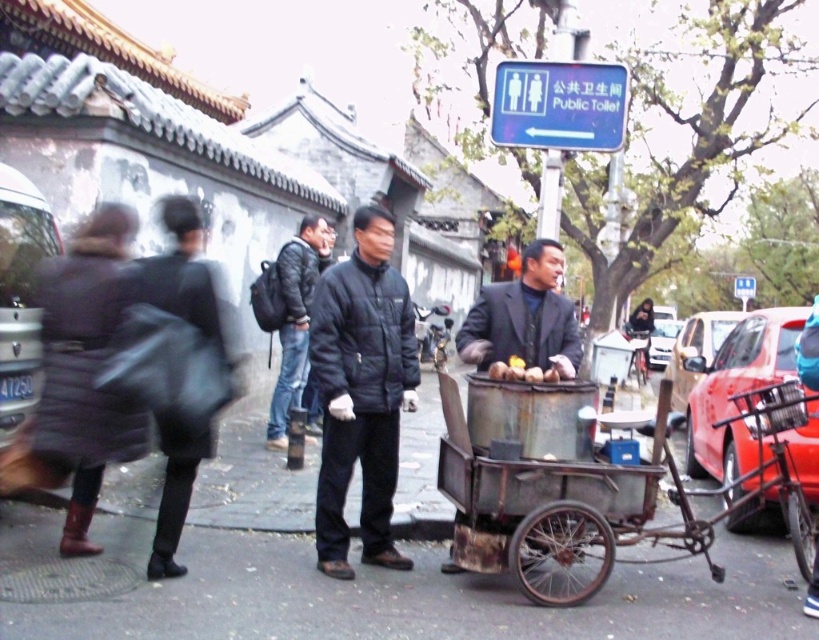
Can you confirm if dark gray jacket at center is thinner than dark gray puffy jacket at center?

No, dark gray jacket at center is not thinner than dark gray puffy jacket at center.

Find the location of a particular element. dark gray jacket at center is located at coordinates (523, 317).

The height and width of the screenshot is (640, 819). Identify the location of dark gray jacket at center. (523, 317).

Does black matte jacket at center appear on the right side of yellow matte apples at center?

Incorrect, black matte jacket at center is not on the right side of yellow matte apples at center.

Based on the photo, is black matte jacket at center to the left of yellow matte apples at center from the viewer's perspective?

Indeed, black matte jacket at center is positioned on the left side of yellow matte apples at center.

Is point (365, 422) positioned before point (534, 369)?

No, (365, 422) is further to viewer.

The image size is (819, 640). I want to click on black matte jacket at center, so click(360, 390).

Who is higher up, black matte jacket at center or metallic red car at right?

black matte jacket at center is above.

Is black matte jacket at center to the right of metallic red car at right from the viewer's perspective?

In fact, black matte jacket at center is to the left of metallic red car at right.

Between point (392, 369) and point (754, 444), which one is positioned in front?

Point (392, 369) is in front.

The height and width of the screenshot is (640, 819). Identify the location of black matte jacket at center. (360, 390).